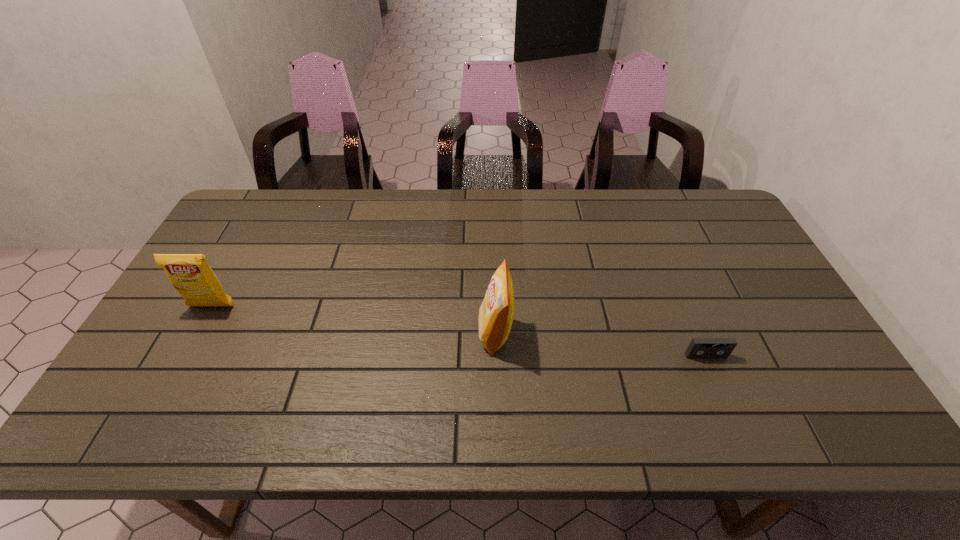
Where is `vacant space at the far edge of the desktop`? The height and width of the screenshot is (540, 960). vacant space at the far edge of the desktop is located at coordinates (347, 228).

The height and width of the screenshot is (540, 960). In the image, there is a desktop. In order to click on vacant space at the near edge in this screenshot , I will do `click(337, 428)`.

In the image, there is a desktop. Find the location of `vacant space at the right edge`. vacant space at the right edge is located at coordinates (769, 351).

I want to click on free space at the far left corner of the desktop, so click(x=284, y=190).

In the image, there is a desktop. What are the coordinates of `blank space at the near left corner` in the screenshot? It's located at (172, 422).

The width and height of the screenshot is (960, 540). What are the coordinates of `free space at the far right corner` in the screenshot? It's located at (699, 225).

Locate an element on the screen. The height and width of the screenshot is (540, 960). free spot between the leftmost object and the shortest object is located at coordinates (459, 331).

At what (x,y) coordinates should I click in order to perform the action: click on unoccupied position between the second object from right to left and the rightmost object. Please return your answer as a coordinate pair (x, y). Image resolution: width=960 pixels, height=540 pixels. Looking at the image, I should click on (601, 345).

Find the location of a particular element. vacant space in between the rightmost object and the right crisp (potato chip) is located at coordinates (601, 345).

Identify the location of free space between the left crisp (potato chip) and the right crisp (potato chip). Image resolution: width=960 pixels, height=540 pixels. [353, 320].